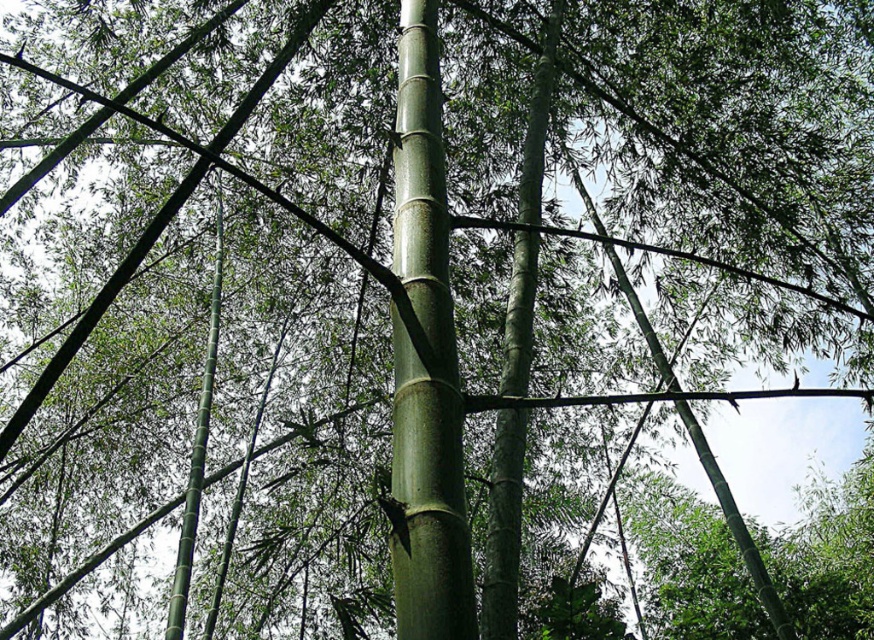
Question: Which point appears farthest from the camera in this image?

Choices:
 (A) (400, 525)
 (B) (177, 586)

Answer: (B)

Question: Does green matte bamboo at center have a larger size compared to green smooth bamboo at center?

Choices:
 (A) yes
 (B) no

Answer: (B)

Question: Among these points, which one is farthest from the camera?

Choices:
 (A) (415, 84)
 (B) (200, 465)

Answer: (B)

Question: Does green matte bamboo at center appear under green smooth bamboo at center?

Choices:
 (A) no
 (B) yes

Answer: (A)

Question: Which point is farther to the camera?

Choices:
 (A) green matte bamboo at center
 (B) green smooth bamboo at center

Answer: (B)

Question: Is green matte bamboo at center closer to camera compared to green smooth bamboo at center?

Choices:
 (A) yes
 (B) no

Answer: (A)